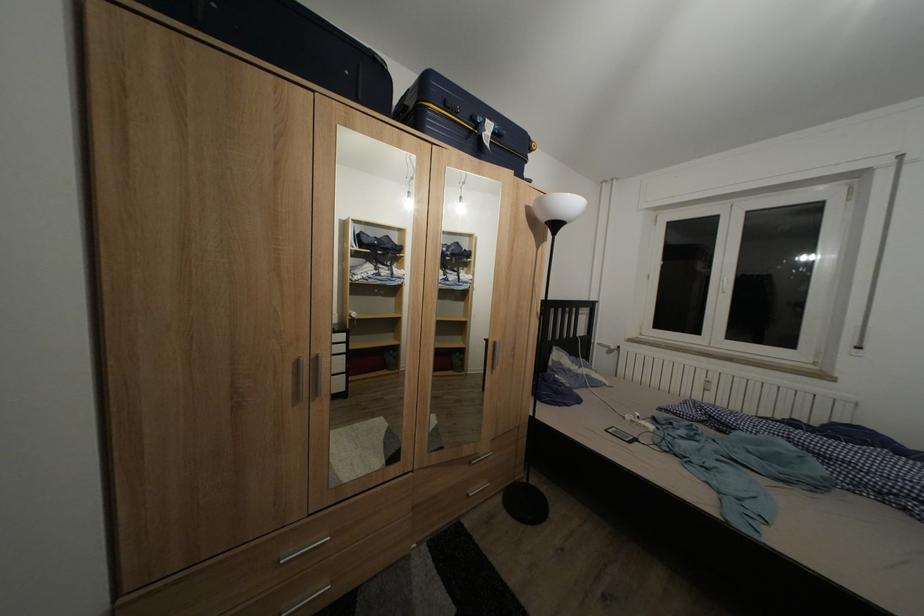
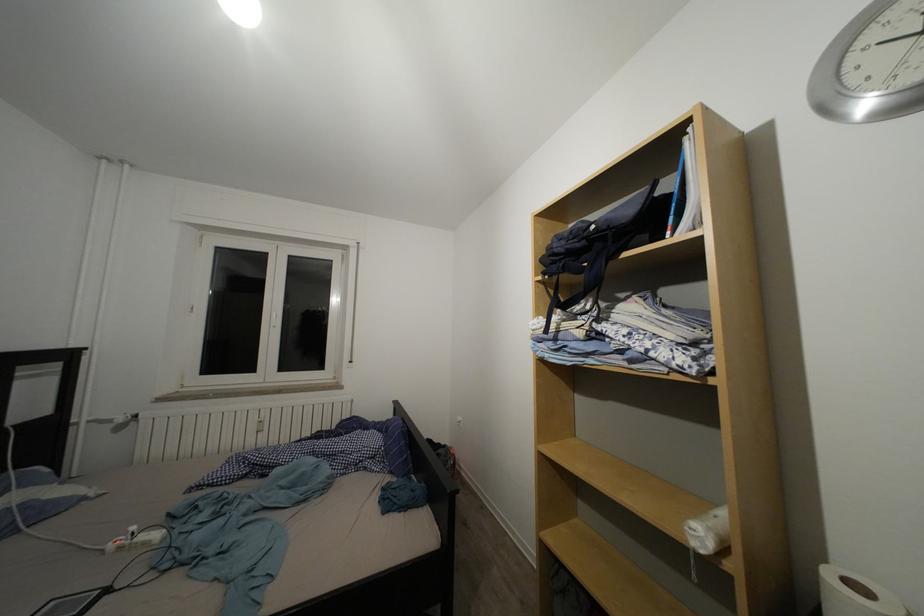
Locate, in the second image, the point that corresponds to point (646, 419) in the first image.

(140, 533)